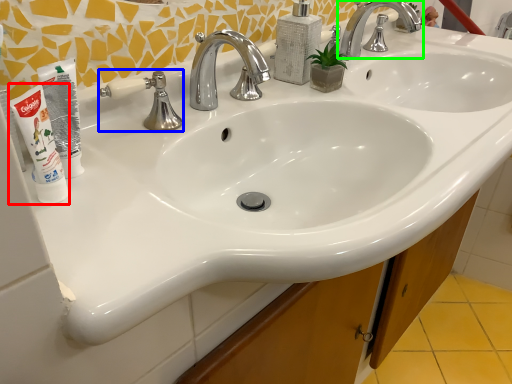
Question: Considering the real-world distances, which object is closest to shaving cream (highlighted by a red box)? plumbing fixture (highlighted by a blue box) or tap (highlighted by a green box).

Choices:
 (A) plumbing fixture
 (B) tap

Answer: (A)